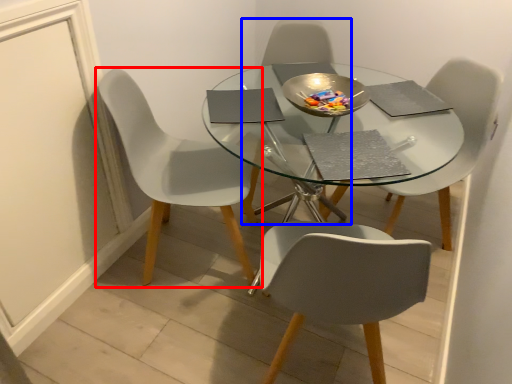
Question: Which of the following is the farthest to the observer, chair (highlighted by a red box) or chair (highlighted by a blue box)?

Choices:
 (A) chair
 (B) chair

Answer: (B)